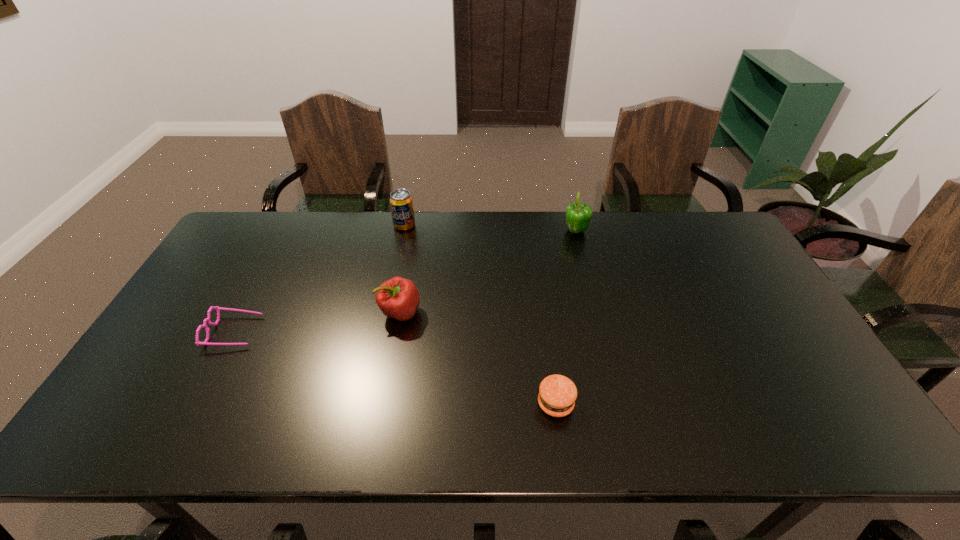
Identify the location of the taller bell pepper. (578, 215).

Identify the location of the farther bell pepper. (578, 215).

At what (x,y) coordinates should I click in order to perform the action: click on soda can. Please return your answer as a coordinate pair (x, y). The image size is (960, 540). Looking at the image, I should click on (401, 203).

Identify the location of the left bell pepper. The width and height of the screenshot is (960, 540). (398, 298).

The height and width of the screenshot is (540, 960). I want to click on the nearer bell pepper, so click(398, 298).

Find the location of a particular element. Image resolution: width=960 pixels, height=540 pixels. the fourth object from left to right is located at coordinates (557, 394).

Locate an element on the screen. The height and width of the screenshot is (540, 960). patty is located at coordinates (557, 394).

Where is `the shortest object`? The image size is (960, 540). the shortest object is located at coordinates (217, 308).

Identify the location of the leftmost object. Image resolution: width=960 pixels, height=540 pixels. (217, 308).

This screenshot has width=960, height=540. What are the coordinates of `free space located 0.110m on the front of the taller bell pepper` in the screenshot? It's located at (584, 260).